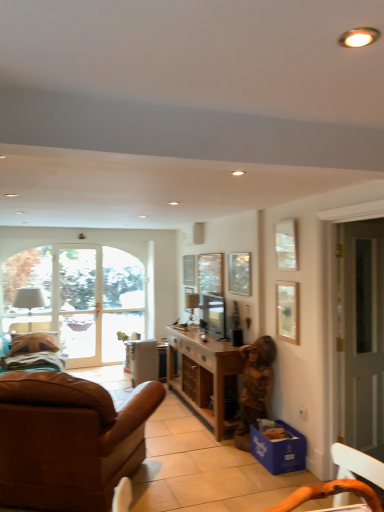
What do you see at coordinates (214, 314) in the screenshot?
I see `satin black tv at center, which appears as the first television when viewed from the front` at bounding box center [214, 314].

The image size is (384, 512). I want to click on satin black television at center, the 2th television from the front, so click(191, 304).

The width and height of the screenshot is (384, 512). Describe the element at coordinates (203, 374) in the screenshot. I see `wooden cabinet at center` at that location.

Describe the element at coordinates (237, 337) in the screenshot. This screenshot has height=512, width=384. I see `matte black speaker at center` at that location.

Where is `matte black speaker at center`? The image size is (384, 512). matte black speaker at center is located at coordinates (x=237, y=337).

This screenshot has height=512, width=384. What do you see at coordinates (279, 449) in the screenshot?
I see `blue cardboard box at lower right` at bounding box center [279, 449].

Find the location of a particular element. This screenshot has height=512, width=384. satin black tv at center, which appears as the second television when viewed from the back is located at coordinates (214, 314).

Between clear glass door at center and orange wood chair at lower right, which one appears on the left side from the viewer's perspective?

From the viewer's perspective, clear glass door at center appears more on the left side.

Can you confirm if clear glass door at center is smaller than orange wood chair at lower right?

Actually, clear glass door at center might be larger than orange wood chair at lower right.

Is point (96, 260) in front of point (315, 497)?

No.

Considering the points (215, 325) and (262, 359), which point is behind, point (215, 325) or point (262, 359)?

The point (215, 325) is behind.

Does satin black tv at center, which appears as the first television when viewed from the front, touch wooden statue at lower right?

No, satin black tv at center, which appears as the first television when viewed from the front, is not next to wooden statue at lower right.

Consider the image. Is satin black tv at center, which appears as the second television when viewed from the back, to the left of wooden statue at lower right from the viewer's perspective?

Correct, you'll find satin black tv at center, which appears as the second television when viewed from the back, to the left of wooden statue at lower right.

Does satin black tv at center, which appears as the second television when viewed from the back, have a greater height compared to wooden statue at lower right?

No, satin black tv at center, which appears as the second television when viewed from the back, is not taller than wooden statue at lower right.

From a real-world perspective, is satin black tv at center, which appears as the second television when viewed from the back, positioned above or below clear glass window screen at center?

satin black tv at center, which appears as the second television when viewed from the back, is situated lower than clear glass window screen at center in the real world.

Which point is more distant from viewer, (x=214, y=301) or (x=221, y=292)?

The point (x=214, y=301) is farther.

How many degrees apart are the facing directions of satin black tv at center, which appears as the first television when viewed from the front, and clear glass window screen at center?

3.02 degrees.

Is satin black tv at center, which appears as the first television when viewed from the front, next to clear glass window screen at center and touching it?

No.

Based on the photo, considering the relative sizes of clear glass door at center and wooden picture frame at upper center, arranged as the 1th picture frame when viewed from the back, in the image provided, is clear glass door at center shorter than wooden picture frame at upper center, arranged as the 1th picture frame when viewed from the back,?

In fact, clear glass door at center may be taller than wooden picture frame at upper center, arranged as the 1th picture frame when viewed from the back.

Consider the image. From a real-world perspective, is clear glass door at center above or below wooden picture frame at upper center, which ranks as the 1th picture frame in left-to-right order?

clear glass door at center is below wooden picture frame at upper center, which ranks as the 1th picture frame in left-to-right order.

Is clear glass door at center turned away from wooden picture frame at upper center, which ranks as the 1th picture frame in left-to-right order?

No, clear glass door at center is not facing the opposite direction of wooden picture frame at upper center, which ranks as the 1th picture frame in left-to-right order.

Is clear glass door at center in front of wooden picture frame at upper center, arranged as the 1th picture frame when viewed from the back?

No, it is behind wooden picture frame at upper center, arranged as the 1th picture frame when viewed from the back.

From the image's perspective, which is above, wooden cabinet at center or clear glass window screen at center?

clear glass window screen at center.

Who is taller, wooden cabinet at center or clear glass window screen at center?

With more height is wooden cabinet at center.

Is matte white picture frame at upper center, positioned as the 2th picture frame in front-to-back order, thinner than white glass screen door at right?

Yes.

Is matte white picture frame at upper center, which is the second picture frame from left to right, to the left or to the right of white glass screen door at right in the image?

Based on their positions, matte white picture frame at upper center, which is the second picture frame from left to right, is located to the left of white glass screen door at right.

Does point (283, 260) appear closer or farther from the camera than point (373, 278)?

Clearly, point (283, 260) is more distant from the camera than point (373, 278).

You are a GUI agent. You are given a task and a screenshot of the screen. Output one action in this format:
    pyautogui.click(x=<x>, y=<y>)
    Task: Click on the screen door in front of the matte white picture frame at upper center, positioned as the 2th picture frame in front-to-back order
    
    Given the screenshot: What is the action you would take?
    pyautogui.click(x=363, y=335)

Which object is further away from the camera, clear glass window screen at center or brown leather couch at lower left?

clear glass window screen at center is further from the camera.

How many degrees apart are the facing directions of clear glass window screen at center and brown leather couch at lower left?

There is a 119-degree angle between the facing directions of clear glass window screen at center and brown leather couch at lower left.

Looking at this image, which object is positioned more to the left, clear glass window screen at center or brown leather couch at lower left?

Positioned to the left is brown leather couch at lower left.

Is clear glass window screen at center turned away from brown leather couch at lower left?

No, brown leather couch at lower left is not at the back of clear glass window screen at center.

Find the location of `glass door that is behind the orange wood chair at lower right`. glass door that is behind the orange wood chair at lower right is located at coordinates (76, 300).

The image size is (384, 512). I want to click on the 1st television counting from the left side of the wooden statue at lower right, so click(x=214, y=314).

Which object lies nearer to the anchor point satin black television at center, the 2th television from the front, wooden picture frame at upper center, arranged as the 1th picture frame when viewed from the back, or wooden cabinet at center?

wooden cabinet at center lies closer to satin black television at center, the 2th television from the front, than the other object.

Based on their spatial positions, is clear glass window screen at center or white fabric lampshade at left further from satin black tv at center, which appears as the first television when viewed from the front?

white fabric lampshade at left.

Looking at the image, which one is located further to matte wood desk at center, clear glass window screen at center or brown leather couch at lower left?

brown leather couch at lower left is positioned further to the anchor matte wood desk at center.

When comparing their distances from clear glass window at center, does blue cardboard box at lower right or matte black speaker at center seem further?

blue cardboard box at lower right.

Which object lies further to the anchor point wooden cabinet at center, clear glass window screen at center or white fabric lampshade at left?

white fabric lampshade at left is further to wooden cabinet at center.

When comparing their distances from clear glass door at center, does orange wood chair at lower right or wooden cabinet at center seem further?

orange wood chair at lower right lies further to clear glass door at center than the other object.

Looking at the image, which one is located closer to matte black speaker at center, matte wood desk at center or white glass screen door at right?

matte wood desk at center is closer to matte black speaker at center.

Which object lies nearer to the anchor point clear glass window at center, brown leather couch at lower left or satin black tv at center, which appears as the first television when viewed from the front?

satin black tv at center, which appears as the first television when viewed from the front.

Locate an element on the screen. The height and width of the screenshot is (512, 384). loudspeaker located between blue cardboard box at lower right and clear glass window at center in the depth direction is located at coordinates (237, 337).

Locate an element on the screen. This screenshot has width=384, height=512. glass door between white fabric lampshade at left and clear glass window screen at center in the horizontal direction is located at coordinates (76, 300).

Find the location of a particular element. desk positioned between wooden picture frame at upper center, the 3th picture frame when ordered from right to left, and clear glass window at center from near to far is located at coordinates (146, 361).

The image size is (384, 512). I want to click on person between blue cardboard box at lower right and matte wood desk at center from front to back, so click(x=256, y=381).